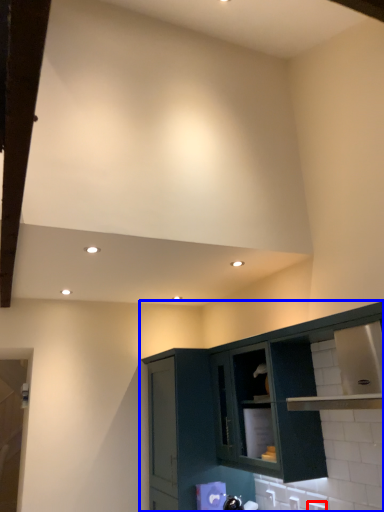
Question: Which object appears farthest to the camera in this image, electric outlet (highlighted by a red box) or cabinetry (highlighted by a blue box)?

Choices:
 (A) electric outlet
 (B) cabinetry

Answer: (A)